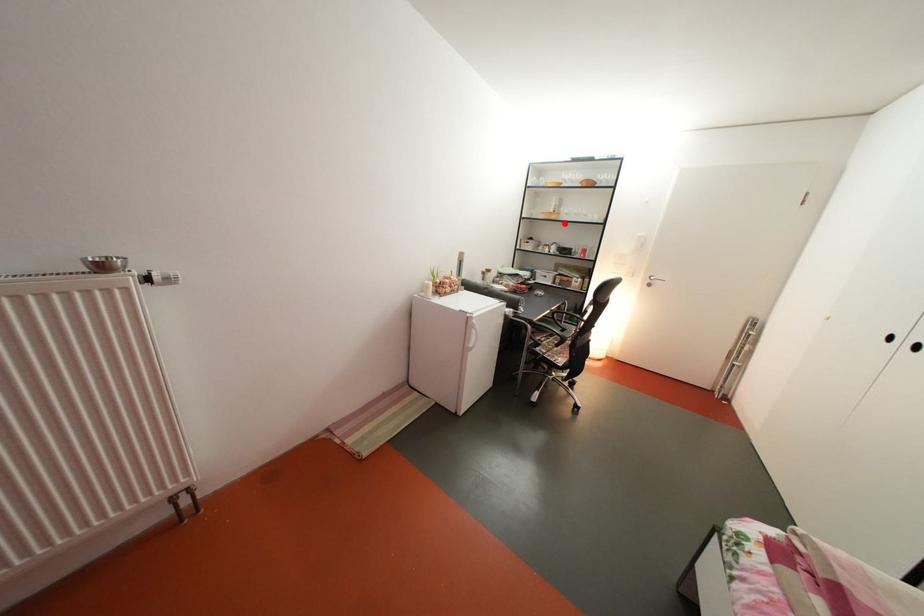
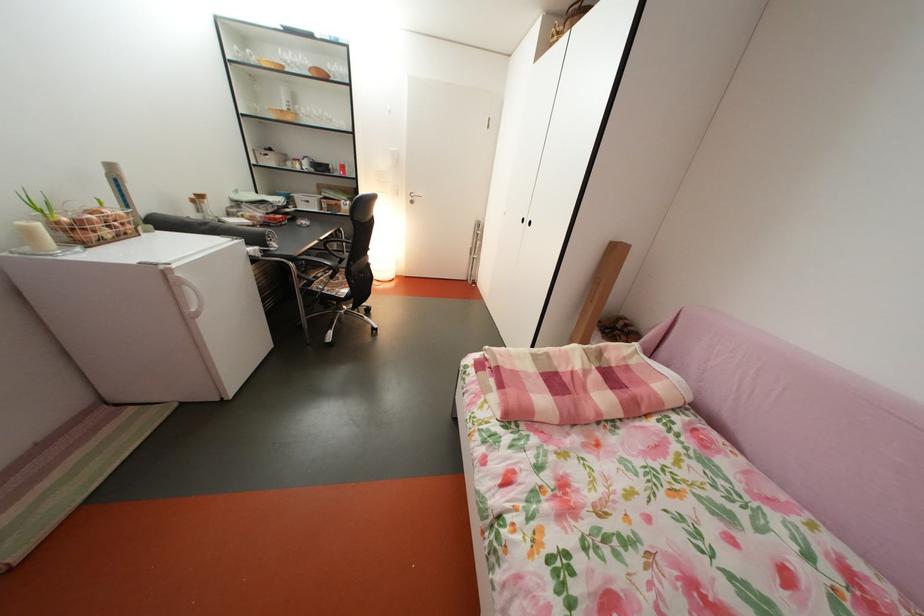
Locate, in the second image, the point that corresponds to the highlighted location in the first image.

(300, 124)